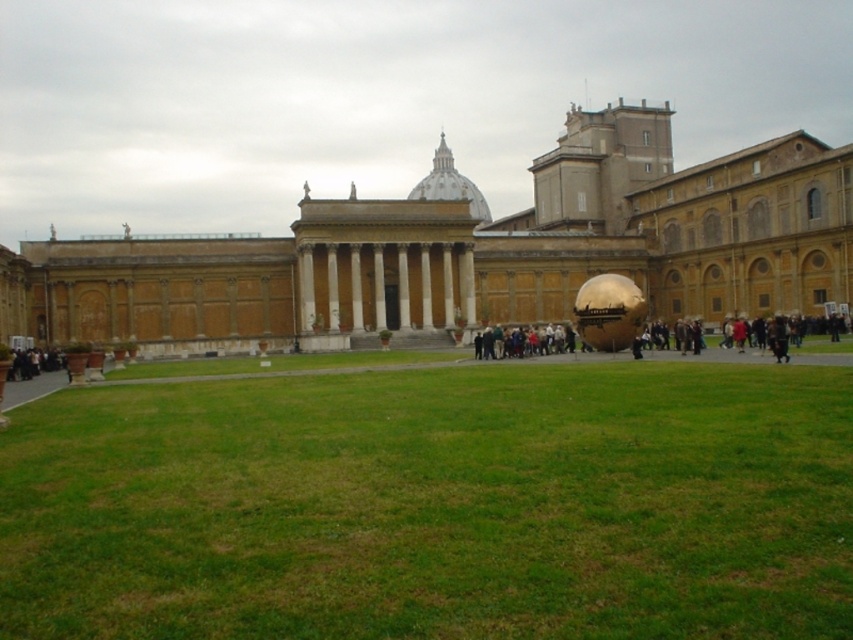
Question: Is golden polished sphere at center closer to camera compared to golden metallic sphere at center?

Choices:
 (A) no
 (B) yes

Answer: (B)

Question: Which of these objects is positioned farthest from the golden metallic sphere at center?

Choices:
 (A) green grass at center
 (B) golden polished sphere at center

Answer: (A)

Question: Which point is farther from the camera taking this photo?

Choices:
 (A) (788, 193)
 (B) (498, 346)

Answer: (A)

Question: Which of the following is the farthest from the observer?

Choices:
 (A) golden metallic sphere at center
 (B) green grass at center

Answer: (A)

Question: Is green grass at center further to camera compared to golden polished sphere at center?

Choices:
 (A) yes
 (B) no

Answer: (B)

Question: Where is green grass at center located in relation to golden metallic sphere at center in the image?

Choices:
 (A) left
 (B) right

Answer: (A)